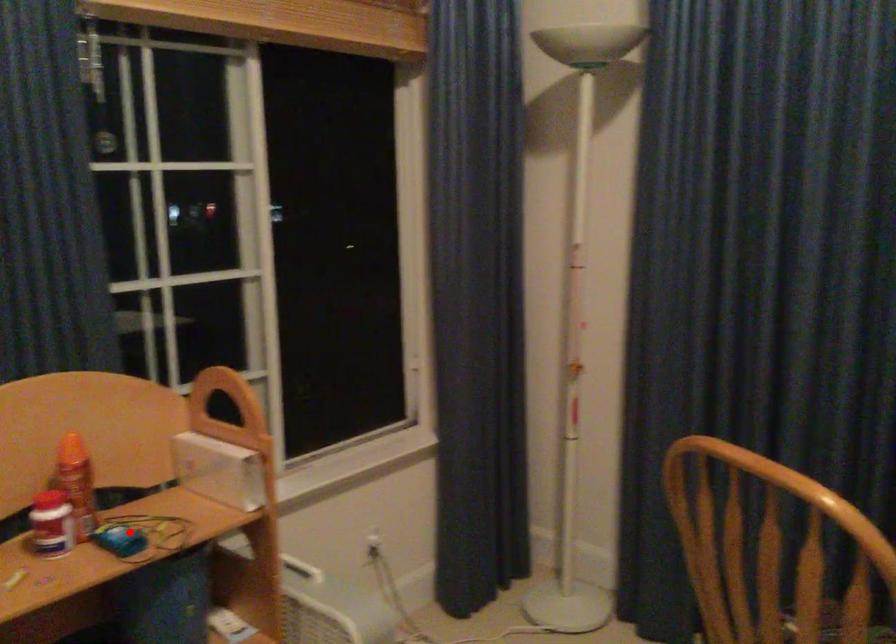
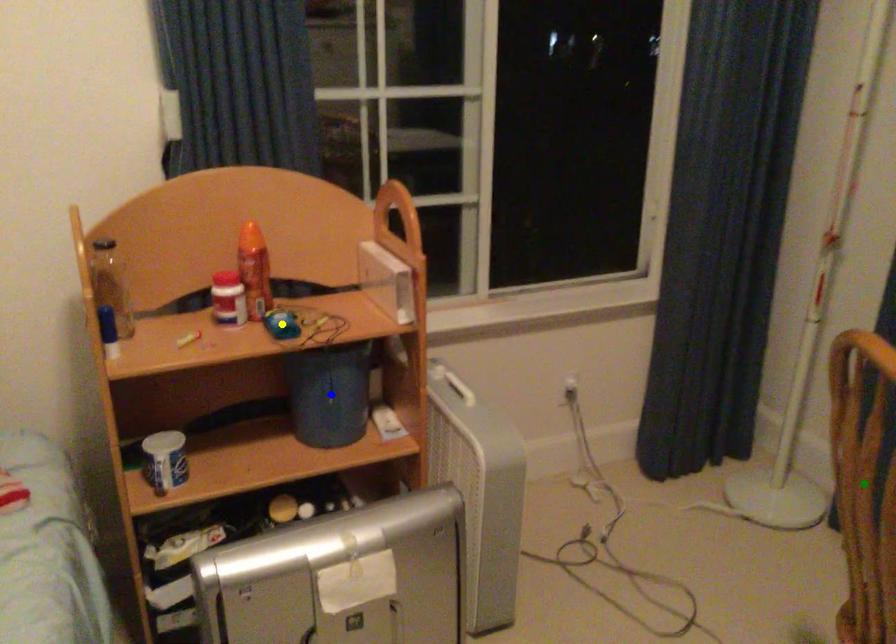
Question: I am providing you with two images of the same scene from different viewpoints. A red point is marked on the first image. You are given multiple points on the second image. Which spot in image 2 lines up with the point in image 1?

Choices:
 (A) green point
 (B) yellow point
 (C) blue point

Answer: (B)